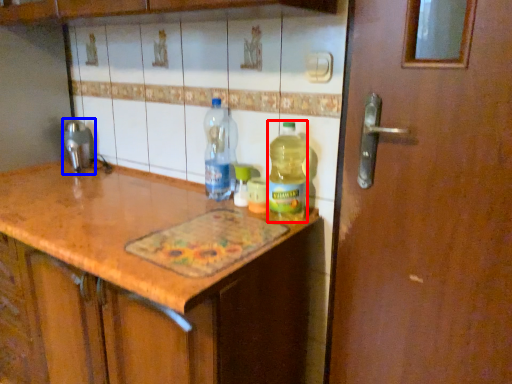
Question: Which object is closer to the camera taking this photo, bottle (highlighted by a red box) or faucet (highlighted by a blue box)?

Choices:
 (A) bottle
 (B) faucet

Answer: (A)